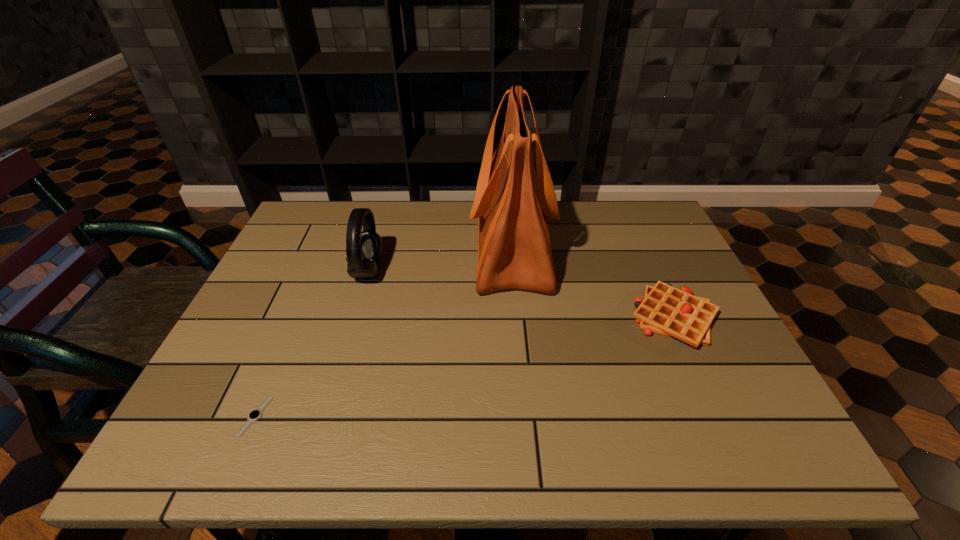
I want to click on free space between the watch and the tallest object, so click(x=384, y=332).

At what (x,y) coordinates should I click in order to perform the action: click on free spot between the second object from right to left and the second object from left to right. Please return your answer as a coordinate pair (x, y). Looking at the image, I should click on (440, 259).

Find the location of a particular element. free point between the third object from left to right and the second shortest object is located at coordinates (592, 283).

Find the location of a particular element. The image size is (960, 540). free spot between the nearest object and the rightmost object is located at coordinates (465, 367).

Locate an element on the screen. This screenshot has width=960, height=540. object that is the third closest to the tallest object is located at coordinates (255, 414).

Locate an element on the screen. The width and height of the screenshot is (960, 540). object that is the nearest to the shopping bag is located at coordinates (666, 310).

In order to click on vacant position in the image that satisfies the following two spatial constraints: 1. on the back side of the waffle; 2. on the earcups of the second tallest object in this screenshot , I will do `click(652, 271)`.

Identify the location of free location that satisfies the following two spatial constraints: 1. on the earcups of the headset; 2. on the front side of the watch. The image size is (960, 540). click(325, 416).

The height and width of the screenshot is (540, 960). Identify the location of vacant point that satisfies the following two spatial constraints: 1. on the front pocket of the second shortest object; 2. on the left side of the third object from left to right. (517, 318).

Find the location of a particular element. The width and height of the screenshot is (960, 540). free space that satisfies the following two spatial constraints: 1. on the earcups of the headset; 2. on the back side of the rightmost object is located at coordinates (354, 318).